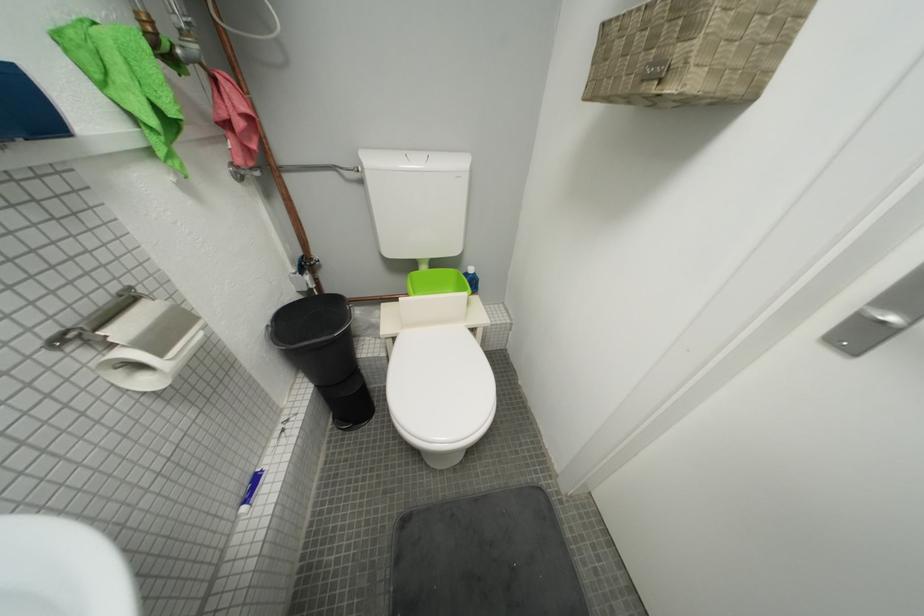
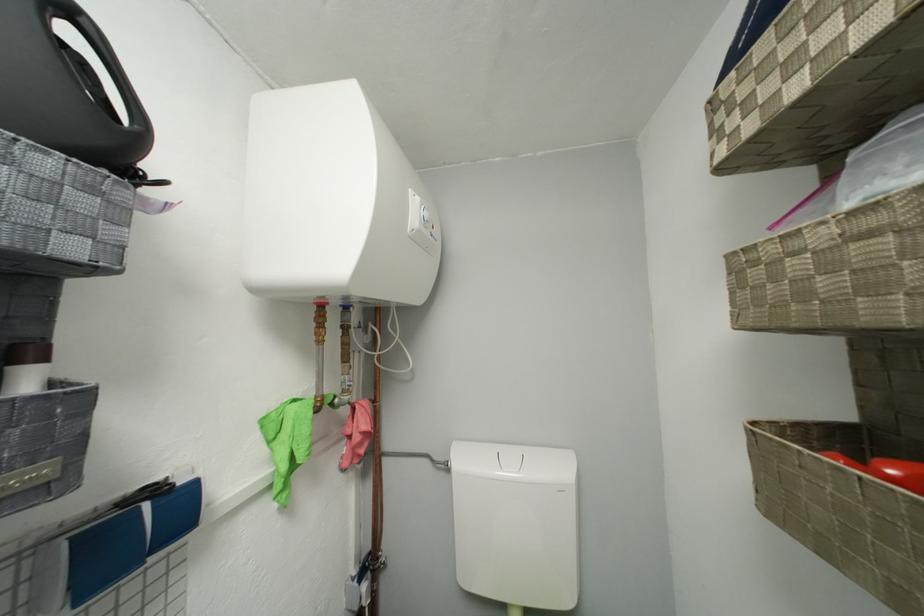
Find the pixel in the second image that matches [161,123] in the first image.

(293, 469)